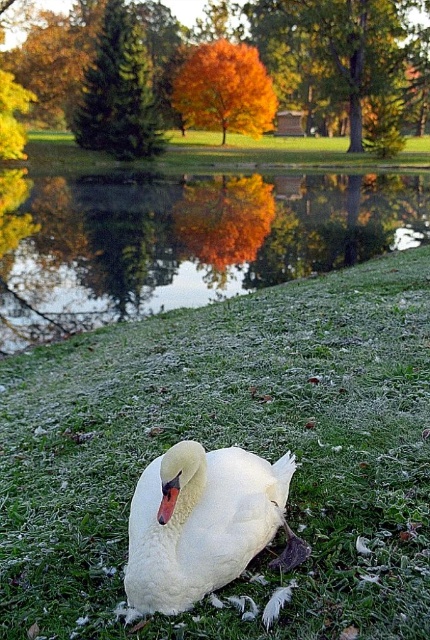
You are standing at the edge of the pond and want to take a photo of the swan. To avoid blocking the view of the water reflection, where should you position yourself relative to the white fluffy grass at lower center?

You should position yourself to the side of the white fluffy grass at lower center to ensure the grass doesn

You are a photographer trying to capture the reflection of the white feathered swan at center in the glossy reflective water at center. Can you expect the reflection to be taller than the swan itself?

The glossy reflective water at center is taller than the white feathered swan at center, so the reflection of the white feathered swan at center would indeed be taller than the swan itself.

You are standing at the edge of the pond and notice the white feathered swan at center and the glossy reflective water at center. Which object is positioned to the left of the other?

The glossy reflective water at center is to the left of the white feathered swan at center.